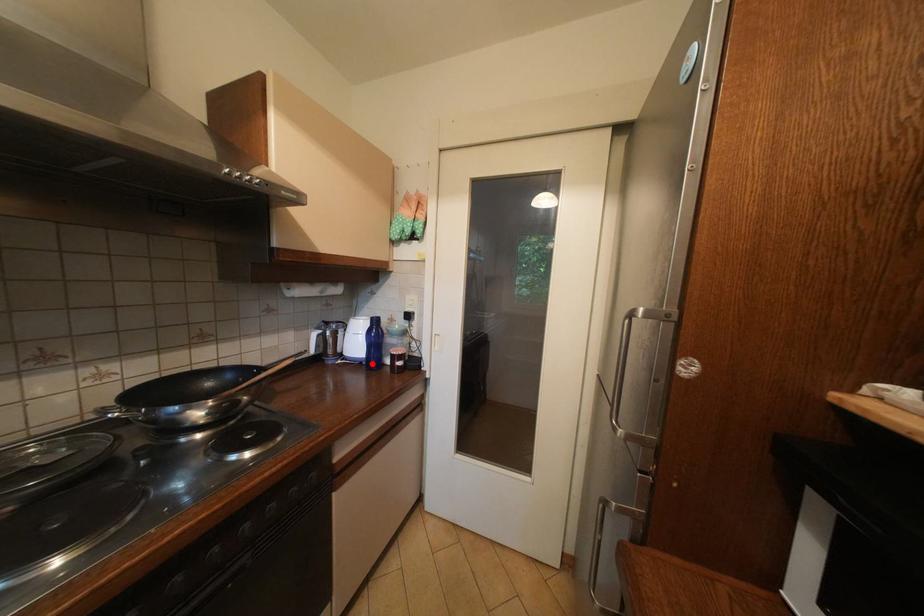
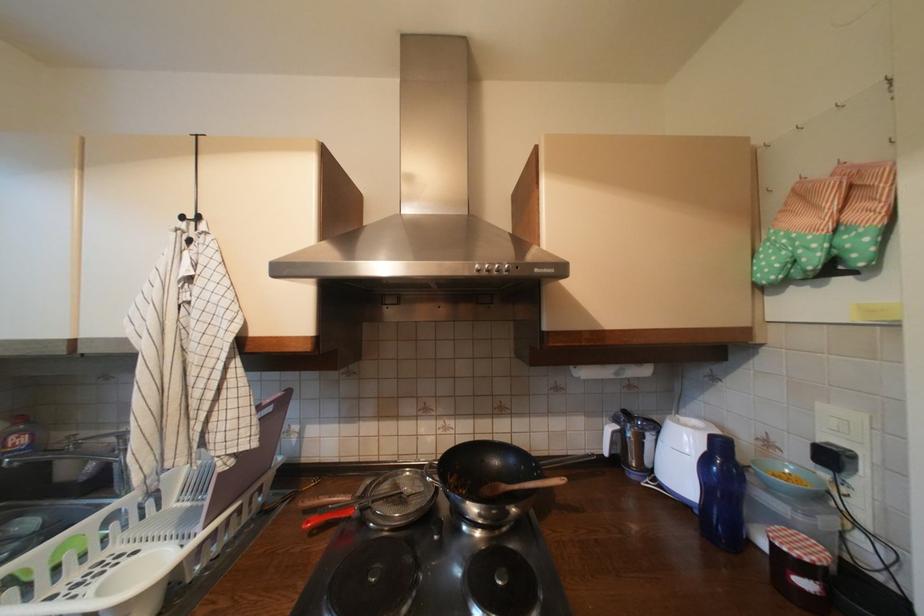
Find the pixel in the second image that matches the highlighted location in the first image.

(704, 513)